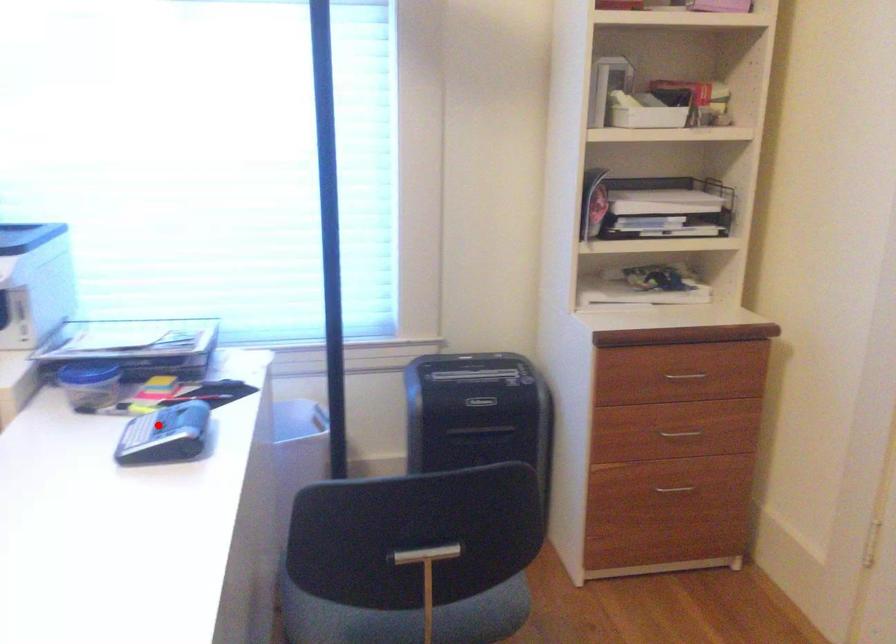
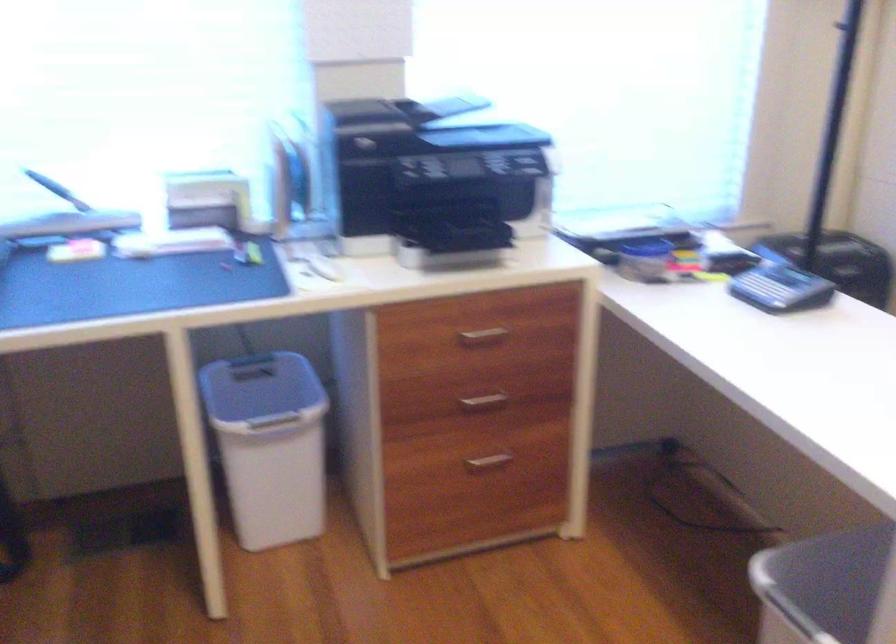
Question: A red point is marked in image1. In image2, is the corresponding 3D point closer to the camera or farther? Reply with the corresponding letter.

Choices:
 (A) The corresponding 3D point is closer.
 (B) The corresponding 3D point is farther.

Answer: (B)